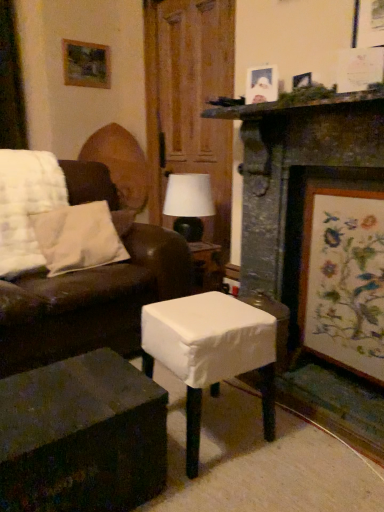
Locate an element on the screen. This screenshot has height=512, width=384. free space above dark wood table at lower left, marked as the first table in a left-to-right arrangement (from a real-world perspective) is located at coordinates (62, 391).